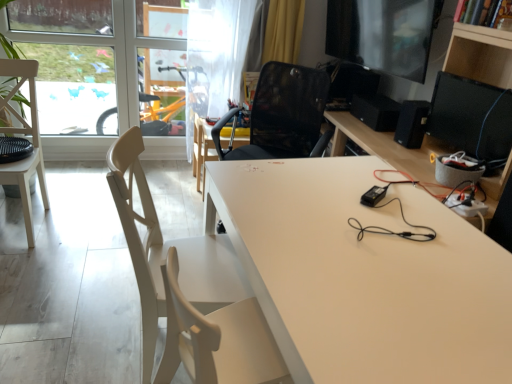
Identify the location of vacant space that's between white wood chair at left, the first chair in the back-to-front sequence, and white wood chair at left, the first chair positioned from the front. This screenshot has height=384, width=512. (76, 273).